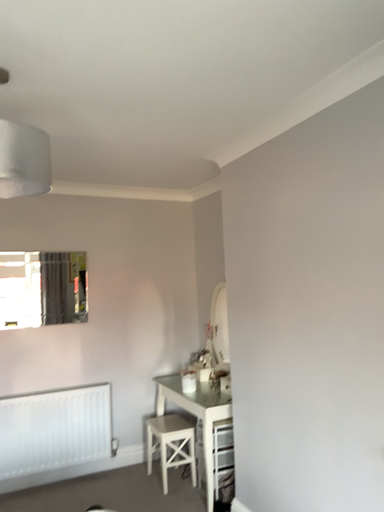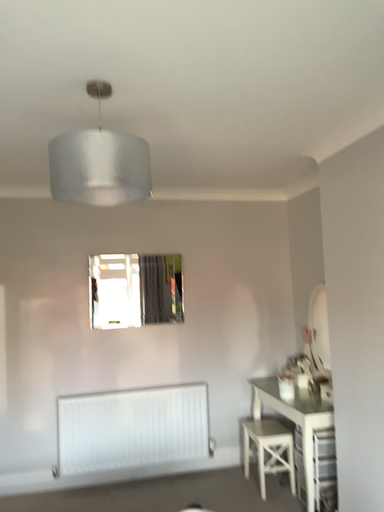
Question: Which way did the camera rotate in the video?

Choices:
 (A) rotated left
 (B) rotated right

Answer: (A)